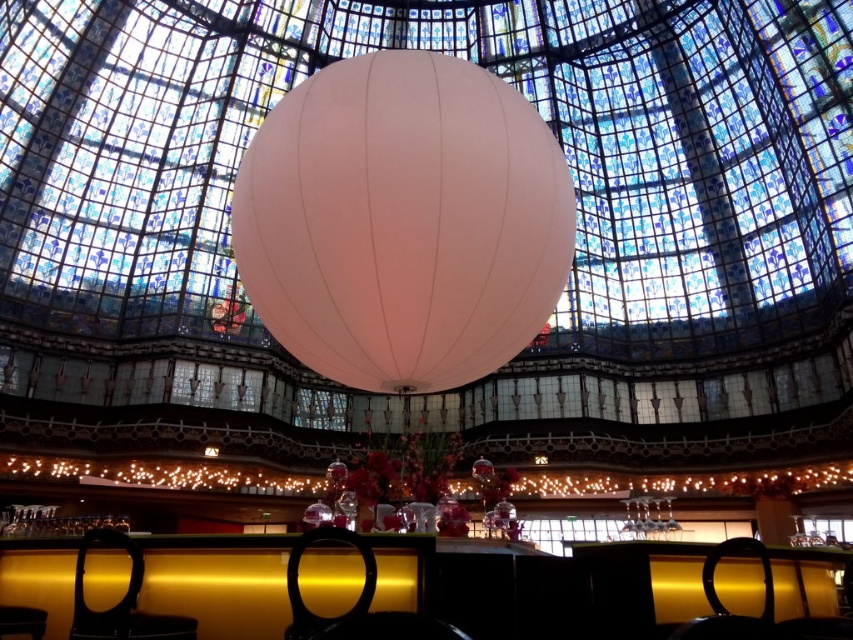
Question: From the image, what is the correct spatial relationship of white matte balloon at center in relation to black leather chair at lower center?

Choices:
 (A) above
 (B) below

Answer: (A)

Question: Among these points, which one is nearest to the camera?

Choices:
 (A) (465, 372)
 (B) (143, 616)

Answer: (B)

Question: Where is white matte balloon at center located in relation to black leather chair at lower center in the image?

Choices:
 (A) left
 (B) right

Answer: (B)

Question: Which of the following is the closest to the observer?

Choices:
 (A) tap(125, 616)
 (B) tap(431, 337)
 (C) tap(706, 566)

Answer: (A)

Question: Does black leather chair at lower left have a smaller size compared to black leather chair at lower right?

Choices:
 (A) yes
 (B) no

Answer: (B)

Question: Which point is closer to the camera taking this photo?

Choices:
 (A) (358, 634)
 (B) (111, 625)

Answer: (A)